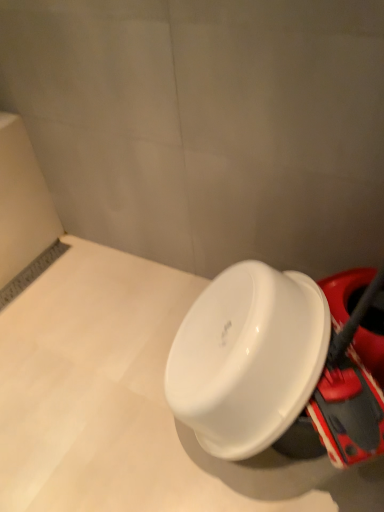
What is the approximate height of white glossy toilet at center?

The height of white glossy toilet at center is 23.28 inches.

What do you see at coordinates (127, 403) in the screenshot?
I see `white glossy toilet at center` at bounding box center [127, 403].

At what (x,y) coordinates should I click in order to perform the action: click on white glossy toilet at center. Please return your answer as a coordinate pair (x, y). Looking at the image, I should click on (127, 403).

Where is `white glossy toilet at center`? The height and width of the screenshot is (512, 384). white glossy toilet at center is located at coordinates (127, 403).